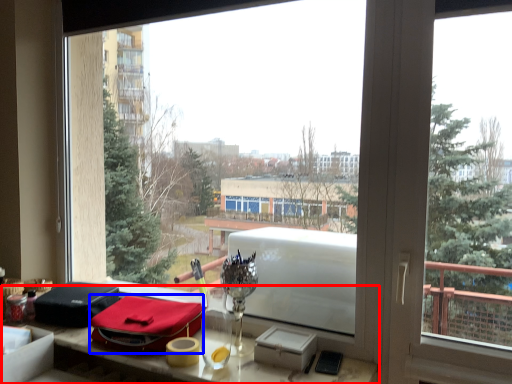
Question: Which of the following is the farthest to the observer, table (highlighted by a red box) or material (highlighted by a blue box)?

Choices:
 (A) table
 (B) material

Answer: (B)